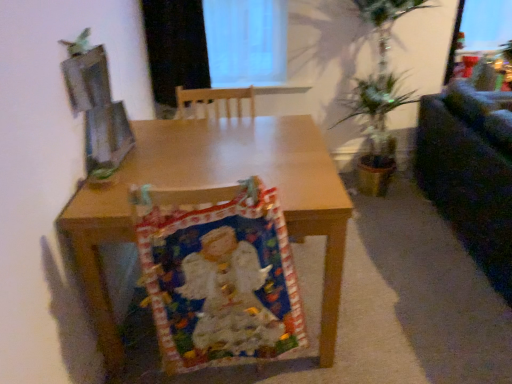
What do you see at coordinates (470, 172) in the screenshot? The width and height of the screenshot is (512, 384). I see `dark fabric couch at right` at bounding box center [470, 172].

Image resolution: width=512 pixels, height=384 pixels. What do you see at coordinates (213, 186) in the screenshot? I see `wooden desk at center` at bounding box center [213, 186].

In order to face multicolored fabric at center, should I rotate leftwards or rightwards?

To face it directly, rotate left by 3.791 degrees.

The image size is (512, 384). What are the coordinates of `dark fabric couch at right` in the screenshot? It's located at (470, 172).

Between dark fabric couch at right and black matte curtain at upper center, which one has less height?

With less height is black matte curtain at upper center.

From the image's perspective, which one is positioned lower, dark fabric couch at right or black matte curtain at upper center?

dark fabric couch at right appears lower in the image.

From a real-world perspective, is dark fabric couch at right physically located above or below black matte curtain at upper center?

dark fabric couch at right is below black matte curtain at upper center.

Visually, is multicolored fabric at center positioned to the left or to the right of wooden desk at center?

Clearly, multicolored fabric at center is on the right of wooden desk at center in the image.

Are multicolored fabric at center and wooden desk at center beside each other?

There is a gap between multicolored fabric at center and wooden desk at center.

Can you tell me how much multicolored fabric at center and wooden desk at center differ in facing direction?

The facing directions of multicolored fabric at center and wooden desk at center are 82.3 degrees apart.

Does dark fabric couch at right come behind wooden desk at center?

Yes, dark fabric couch at right is further from the viewer.

From the image's perspective, which is above, dark fabric couch at right or wooden desk at center?

dark fabric couch at right, from the image's perspective.

Considering the sizes of objects dark fabric couch at right and wooden desk at center in the image provided, who is thinner, dark fabric couch at right or wooden desk at center?

dark fabric couch at right.

Who is smaller, multicolored fabric at center or dark fabric couch at right?

multicolored fabric at center.

Can we say multicolored fabric at center lies outside dark fabric couch at right?

Indeed, multicolored fabric at center is completely outside dark fabric couch at right.

Are multicolored fabric at center and dark fabric couch at right located far from each other?

Yes, multicolored fabric at center and dark fabric couch at right are located far from each other.

Would you consider wooden desk at center to be distant from dark fabric couch at right?

That's right, there is a large distance between wooden desk at center and dark fabric couch at right.

In terms of height, does wooden desk at center look taller or shorter compared to dark fabric couch at right?

Considering their sizes, wooden desk at center has less height than dark fabric couch at right.

Could you tell me if wooden desk at center is facing dark fabric couch at right?

Yes, wooden desk at center is aimed at dark fabric couch at right.

Is multicolored fabric at center positioned behind black matte curtain at upper center?

No.

What's the angular difference between multicolored fabric at center and black matte curtain at upper center's facing directions?

multicolored fabric at center and black matte curtain at upper center are facing 82.9 degrees away from each other.

Is multicolored fabric at center positioned beyond the bounds of black matte curtain at upper center?

Yes.

From a real-world perspective, does multicolored fabric at center sit lower than black matte curtain at upper center?

Indeed, from a real-world perspective, multicolored fabric at center is positioned beneath black matte curtain at upper center.

Can you tell me how much wooden desk at center and multicolored fabric at center differ in facing direction?

82.3 degrees separate the facing orientations of wooden desk at center and multicolored fabric at center.

Considering the sizes of objects wooden desk at center and multicolored fabric at center in the image provided, who is bigger, wooden desk at center or multicolored fabric at center?

Bigger between the two is wooden desk at center.

Which point is more distant from viewer, (108,312) or (158,320)?

The point (108,312) is more distant.

From a real-world perspective, which is physically above, wooden desk at center or multicolored fabric at center?

From a 3D spatial view, multicolored fabric at center is above.

The height and width of the screenshot is (384, 512). Find the location of `curtain above the dark fabric couch at right (from a real-world perspective)`. curtain above the dark fabric couch at right (from a real-world perspective) is located at coordinates (175, 47).

I want to click on blanket below the wooden desk at center (from the image's perspective), so click(220, 280).

From the image, which object appears to be nearer to multicolored fabric at center, dark fabric couch at right or wooden desk at center?

wooden desk at center.

Looking at the image, which one is located further to dark fabric couch at right, wooden desk at center or multicolored fabric at center?

multicolored fabric at center.

Which object lies further to the anchor point dark fabric couch at right, wooden desk at center or black matte curtain at upper center?

black matte curtain at upper center.

Looking at the image, which one is located further to wooden desk at center, dark fabric couch at right or black matte curtain at upper center?

Among the two, dark fabric couch at right is located further to wooden desk at center.

Which object lies nearer to the anchor point dark fabric couch at right, multicolored fabric at center or black matte curtain at upper center?

Among the two, multicolored fabric at center is located nearer to dark fabric couch at right.

From the image, which object appears to be nearer to wooden desk at center, black matte curtain at upper center or dark fabric couch at right?

Based on the image, black matte curtain at upper center appears to be nearer to wooden desk at center.

Looking at the image, which one is located further to multicolored fabric at center, dark fabric couch at right or black matte curtain at upper center?

The object further to multicolored fabric at center is black matte curtain at upper center.

Considering their positions, is multicolored fabric at center positioned further to wooden desk at center than dark fabric couch at right?

Based on the image, dark fabric couch at right appears to be further to wooden desk at center.

The image size is (512, 384). What are the coordinates of `desk between multicolored fabric at center and black matte curtain at upper center along the z-axis` in the screenshot? It's located at (213, 186).

Image resolution: width=512 pixels, height=384 pixels. Identify the location of blanket situated between black matte curtain at upper center and dark fabric couch at right from left to right. (220, 280).

Where is `desk located between black matte curtain at upper center and dark fabric couch at right in the left-right direction`? This screenshot has width=512, height=384. desk located between black matte curtain at upper center and dark fabric couch at right in the left-right direction is located at coordinates click(213, 186).

At what (x,y) coordinates should I click in order to perform the action: click on blanket located between wooden desk at center and dark fabric couch at right in the left-right direction. Please return your answer as a coordinate pair (x, y). The width and height of the screenshot is (512, 384). Looking at the image, I should click on (220, 280).